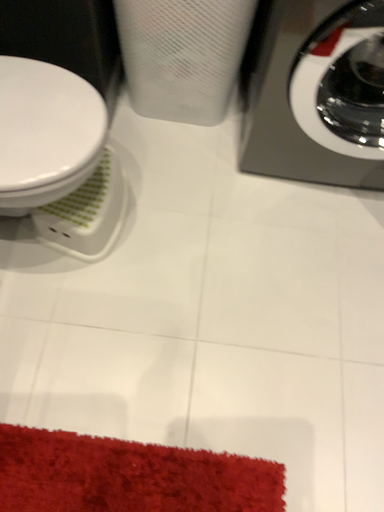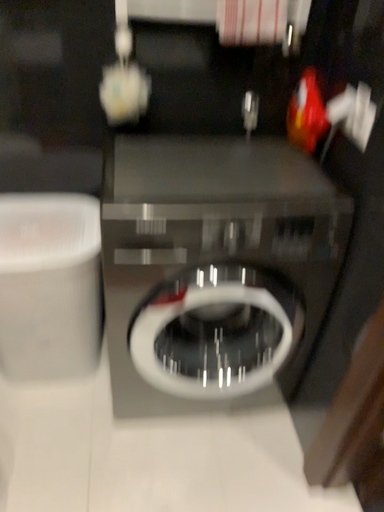
Question: Which way did the camera rotate in the video?

Choices:
 (A) rotated right
 (B) rotated left

Answer: (A)